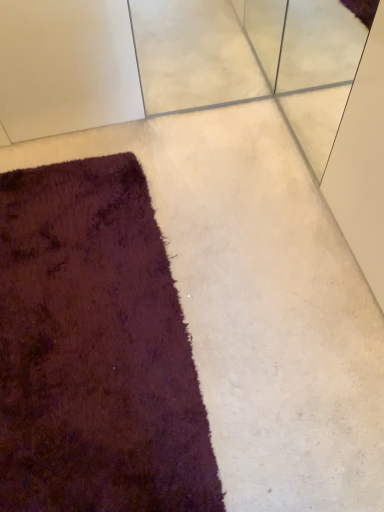
The height and width of the screenshot is (512, 384). Identify the location of white textured concrete at upper center. (192, 55).

What do you see at coordinates (192, 55) in the screenshot? The height and width of the screenshot is (512, 384). I see `white textured concrete at upper center` at bounding box center [192, 55].

Measure the distance between point (72, 337) and camera.

They are 1.14 meters apart.

In order to face shaggy dark purple rug at lower left, should I rotate leftwards or rightwards?

You should rotate left by 14.560 degrees.

The height and width of the screenshot is (512, 384). What do you see at coordinates (95, 350) in the screenshot?
I see `shaggy dark purple rug at lower left` at bounding box center [95, 350].

The height and width of the screenshot is (512, 384). I want to click on shaggy dark purple rug at lower left, so click(x=95, y=350).

Measure the distance between shaggy dark purple rug at lower left and camera.

shaggy dark purple rug at lower left and camera are 36.61 inches apart.

The width and height of the screenshot is (384, 512). What are the coordinates of `white textured concrete at upper center` in the screenshot? It's located at (192, 55).

Is white textured concrete at upper center to the left or to the right of shaggy dark purple rug at lower left in the image?

white textured concrete at upper center is positioned on shaggy dark purple rug at lower left's right side.

Which is in front, white textured concrete at upper center or shaggy dark purple rug at lower left?

shaggy dark purple rug at lower left.

Considering the positions of point (194, 98) and point (67, 218), is point (194, 98) closer or farther from the camera than point (67, 218)?

Point (194, 98).

From the image's perspective, is white textured concrete at upper center located beneath shaggy dark purple rug at lower left?

Actually, white textured concrete at upper center appears above shaggy dark purple rug at lower left in the image.

From a real-world perspective, between white textured concrete at upper center and shaggy dark purple rug at lower left, who is vertically lower?

white textured concrete at upper center is physically lower.

Does white textured concrete at upper center have a greater width compared to shaggy dark purple rug at lower left?

In fact, white textured concrete at upper center might be narrower than shaggy dark purple rug at lower left.

From their relative heights in the image, would you say white textured concrete at upper center is taller or shorter than shaggy dark purple rug at lower left?

Considering their sizes, white textured concrete at upper center has more height than shaggy dark purple rug at lower left.

Considering the sizes of objects white textured concrete at upper center and shaggy dark purple rug at lower left in the image provided, who is bigger, white textured concrete at upper center or shaggy dark purple rug at lower left?

Bigger between the two is shaggy dark purple rug at lower left.

Is white textured concrete at upper center positioned beyond the bounds of shaggy dark purple rug at lower left?

That's correct, white textured concrete at upper center is outside of shaggy dark purple rug at lower left.

Is white textured concrete at upper center far from shaggy dark purple rug at lower left?

white textured concrete at upper center is actually quite close to shaggy dark purple rug at lower left.

Is white textured concrete at upper center positioned with its back to shaggy dark purple rug at lower left?

That's right, white textured concrete at upper center is facing away from shaggy dark purple rug at lower left.

Image resolution: width=384 pixels, height=512 pixels. I want to click on concrete on the right of shaggy dark purple rug at lower left, so click(x=192, y=55).

Can you confirm if shaggy dark purple rug at lower left is positioned to the right of white textured concrete at upper center?

Incorrect, shaggy dark purple rug at lower left is not on the right side of white textured concrete at upper center.

Considering the relative positions of shaggy dark purple rug at lower left and white textured concrete at upper center in the image provided, is shaggy dark purple rug at lower left behind white textured concrete at upper center?

No.

Is point (27, 374) closer to camera compared to point (193, 34)?

Yes, point (27, 374) is closer to viewer.

From the image's perspective, which is below, shaggy dark purple rug at lower left or white textured concrete at upper center?

shaggy dark purple rug at lower left.

From a real-world perspective, which object rests below the other?

In real-world perspective, white textured concrete at upper center is lower.

Considering the sizes of objects shaggy dark purple rug at lower left and white textured concrete at upper center in the image provided, who is thinner, shaggy dark purple rug at lower left or white textured concrete at upper center?

Thinner between the two is white textured concrete at upper center.

Looking at this image, in terms of height, does shaggy dark purple rug at lower left look taller or shorter compared to white textured concrete at upper center?

In the image, shaggy dark purple rug at lower left appears to be shorter than white textured concrete at upper center.

Can you confirm if shaggy dark purple rug at lower left is bigger than white textured concrete at upper center?

Indeed, shaggy dark purple rug at lower left has a larger size compared to white textured concrete at upper center.

Can we say shaggy dark purple rug at lower left lies outside white textured concrete at upper center?

Yes, shaggy dark purple rug at lower left is outside of white textured concrete at upper center.

Is shaggy dark purple rug at lower left placed right next to white textured concrete at upper center?

They are not placed beside each other.

In the scene shown: Is shaggy dark purple rug at lower left oriented away from white textured concrete at upper center?

No, white textured concrete at upper center is not at the back of shaggy dark purple rug at lower left.

What's the angular difference between shaggy dark purple rug at lower left and white textured concrete at upper center's facing directions?

They differ by 89.9 degrees in their facing directions.

Identify the location of concrete located above the shaggy dark purple rug at lower left (from the image's perspective). Image resolution: width=384 pixels, height=512 pixels. (192, 55).

Where is `towel lying below the white textured concrete at upper center (from the image's perspective)`? The width and height of the screenshot is (384, 512). towel lying below the white textured concrete at upper center (from the image's perspective) is located at coordinates (95, 350).

Find the location of a particular element. The height and width of the screenshot is (512, 384). concrete behind the shaggy dark purple rug at lower left is located at coordinates (192, 55).